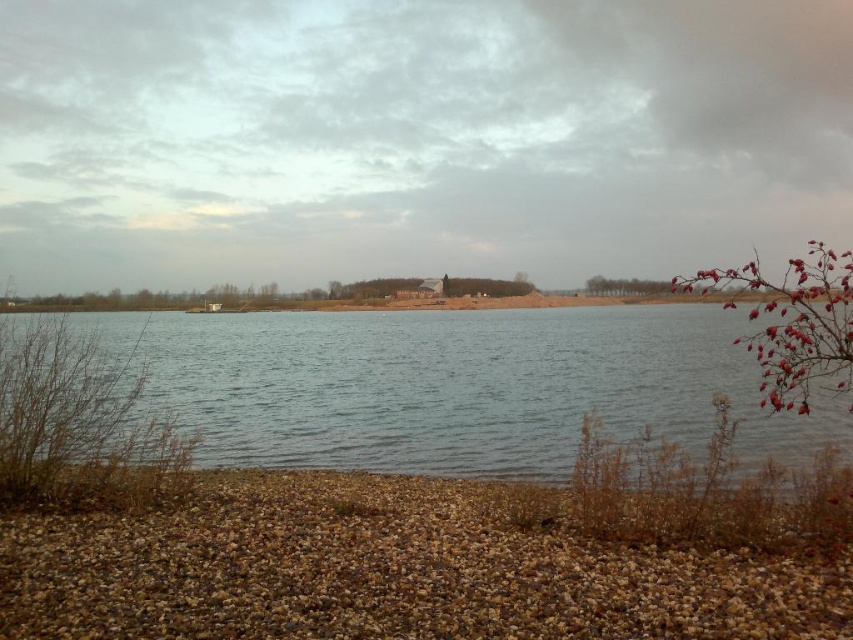
Does brown gravel at lower left have a smaller size compared to clear water at center?

Yes, brown gravel at lower left is smaller than clear water at center.

Based on the photo, between brown gravel at lower left and clear water at center, which one appears on the left side from the viewer's perspective?

clear water at center is more to the left.

Which is in front, point (582, 557) or point (566, 369)?

Positioned in front is point (582, 557).

Identify the location of brown gravel at lower left. The image size is (853, 640). (389, 572).